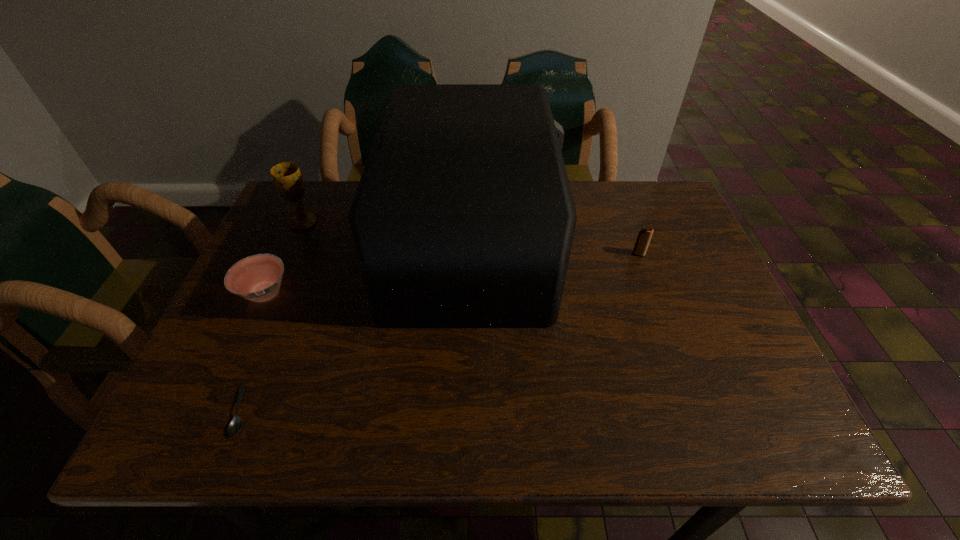
Locate an element on the screen. This screenshot has width=960, height=540. object positioned at the far left corner is located at coordinates (287, 178).

Locate an element on the screen. object that is at the near left corner is located at coordinates click(235, 425).

In order to click on vacant space at the far edge in this screenshot , I will do `click(587, 197)`.

In the image, there is a desktop. Where is `vacant space at the near edge`? vacant space at the near edge is located at coordinates (x=526, y=426).

In order to click on vacant space at the right edge of the desktop in this screenshot , I will do `click(679, 248)`.

This screenshot has height=540, width=960. In the image, there is a desktop. Find the location of `vacant space at the far left corner`. vacant space at the far left corner is located at coordinates (283, 202).

Identify the location of vacant space that's between the soupspoon and the fourth shortest object. This screenshot has height=540, width=960. (272, 316).

Image resolution: width=960 pixels, height=540 pixels. Identify the location of free space between the second object from right to left and the nearest object. (357, 328).

I want to click on vacant area that lies between the fourth tallest object and the fourth shortest object, so click(284, 258).

You are a GUI agent. You are given a task and a screenshot of the screen. Output one action in this format:
    pyautogui.click(x=<x>, y=<y>)
    Task: Click on the free space between the shortest object and the second tallest object
    This screenshot has width=960, height=540.
    Given the screenshot: What is the action you would take?
    pyautogui.click(x=272, y=316)